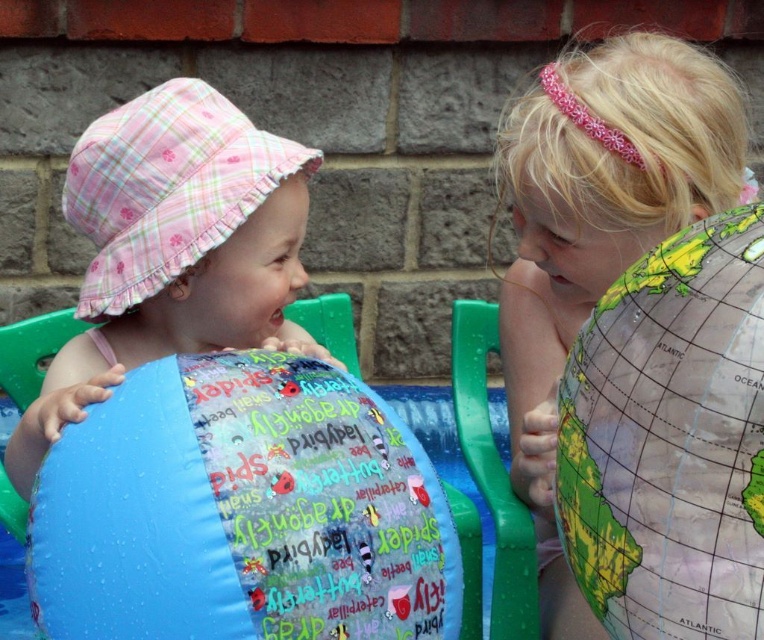
You are a photographer trying to capture a clear shot of both the blue rubber beach ball at left and the pink plaid hat at left. Based on their positions, which object should you focus on first to ensure both are in frame?

The blue rubber beach ball at left is below the pink plaid hat at left, so you should focus on the pink plaid hat at left first to ensure both are in frame.

You are a photographer trying to capture a closeup of the blue rubber beach ball at left. Based on its position coordinates, where should you aim your camera?

The blue rubber beach ball at left is located at coordinates point [241,512], so you should aim your camera at that position to capture a closeup.